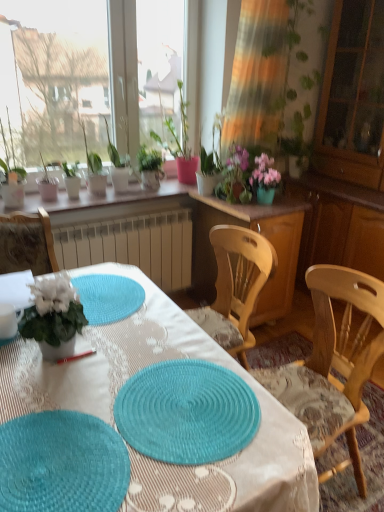
This screenshot has width=384, height=512. In order to click on vacant area that is in front of white matte plant at left, the 5th houseplant from the left in this screenshot , I will do `click(50, 386)`.